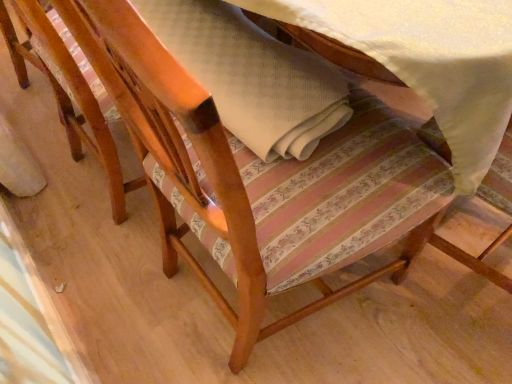
What do you see at coordinates (252, 76) in the screenshot?
I see `white textured fabric at center` at bounding box center [252, 76].

Identify the location of white textured fabric at center. This screenshot has width=512, height=384. (252, 76).

In order to face white textured fabric at center, should I rotate leftwards or rightwards?

Rotate your view left by about 7.368°.

Find the location of a particular element. The width and height of the screenshot is (512, 384). white textured fabric at center is located at coordinates (x=252, y=76).